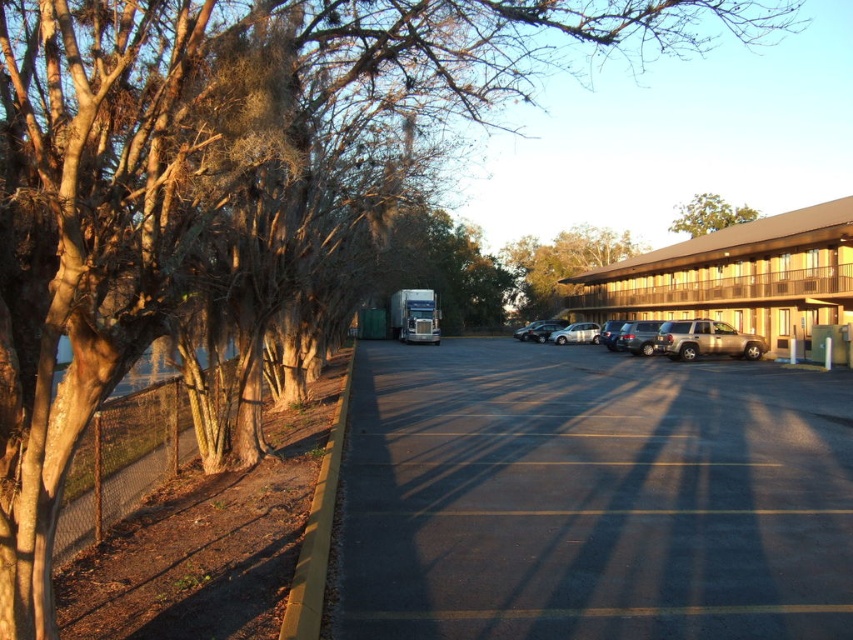
Question: Does beige wood motel at right have a larger size compared to satin silver sedan at center?

Choices:
 (A) no
 (B) yes

Answer: (B)

Question: Which object is the closest to the satin silver suv at center-right?

Choices:
 (A) gold metallic suv at center-right
 (B) black asphalt line at center
 (C) satin silver sedan at center

Answer: (A)

Question: Which point is closer to the camera?

Choices:
 (A) (630, 342)
 (B) (737, 355)

Answer: (B)

Question: Is black asphalt parking lot at center wider than smooth asphalt line at center?

Choices:
 (A) no
 (B) yes

Answer: (B)

Question: Does gold metallic suv at center-right have a larger size compared to satin silver sedan at center?

Choices:
 (A) no
 (B) yes

Answer: (A)

Question: Which point is farther from the camera taking this photo?

Choices:
 (A) coord(395,512)
 (B) coord(744,355)
 (C) coord(561,380)
 (D) coord(389,614)

Answer: (B)